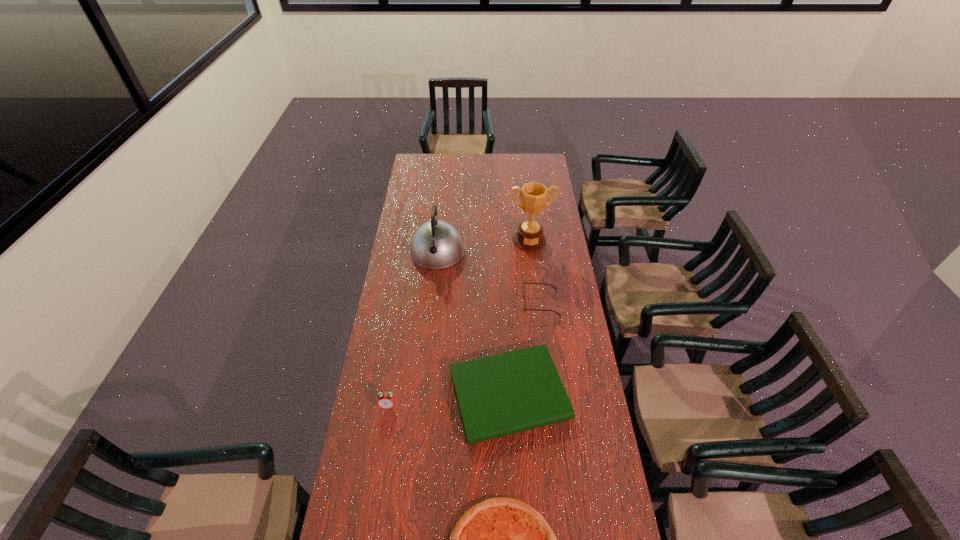
Find the location of `vacant area at the right edge`. vacant area at the right edge is located at coordinates (582, 388).

Locate an element on the screen. This screenshot has width=960, height=540. free space at the far left corner is located at coordinates (429, 160).

The width and height of the screenshot is (960, 540). I want to click on vacant position at the far right corner of the desktop, so click(539, 166).

I want to click on free spot between the second tallest object and the fifth tallest object, so click(473, 323).

This screenshot has width=960, height=540. Identify the location of free space between the award and the third shortest object. (535, 272).

The width and height of the screenshot is (960, 540). I want to click on free space between the alarm clock and the award, so click(x=459, y=323).

Identify the location of free space between the fourth shortest object and the tallest object. The image size is (960, 540). (459, 323).

This screenshot has height=540, width=960. Find the location of `free spot between the tallest object and the third tallest object`. free spot between the tallest object and the third tallest object is located at coordinates (459, 323).

Where is `vacant space that is in between the award and the alarm clock`? The height and width of the screenshot is (540, 960). vacant space that is in between the award and the alarm clock is located at coordinates (459, 323).

What are the coordinates of `object that is the fifth closest to the nearest object` in the screenshot? It's located at (529, 237).